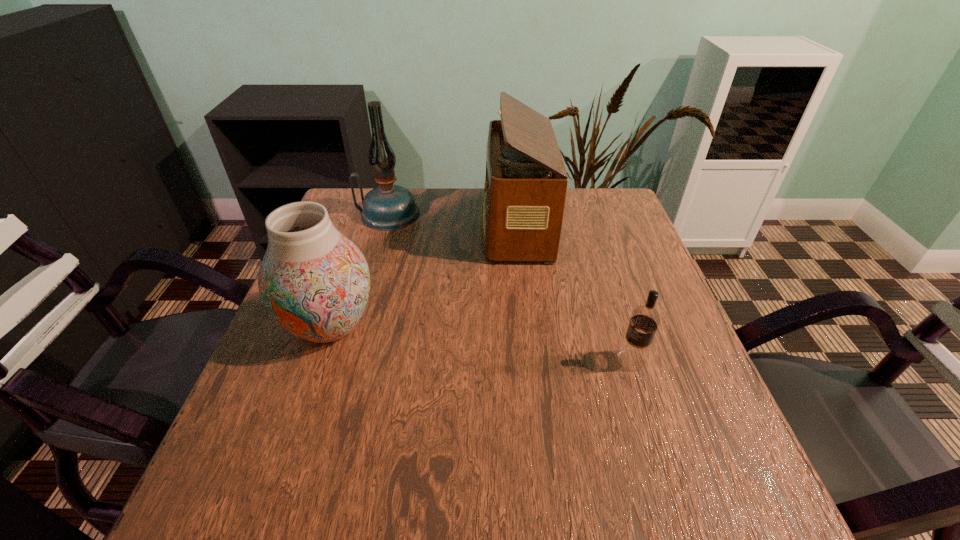
The image size is (960, 540). In order to click on unoccupied position between the oil lamp and the radio receiver in this screenshot , I will do `click(452, 219)`.

I want to click on free space that is in between the vodka and the oil lamp, so click(510, 287).

The width and height of the screenshot is (960, 540). I want to click on free space between the radio receiver and the rightmost object, so click(x=573, y=292).

Point out which object is positioned as the third nearest to the oil lamp. Please provide its 2D coordinates. Your answer should be formatted as a tuple, i.e. [(x, y)], where the tuple contains the x and y coordinates of a point satisfying the conditions above.

[(633, 354)]

Select which object is the second closest to the oil lamp. Please provide its 2D coordinates. Your answer should be formatted as a tuple, i.e. [(x, y)], where the tuple contains the x and y coordinates of a point satisfying the conditions above.

[(314, 281)]

Where is `free location that satisfies the following two spatial constraints: 1. on the back side of the oil lamp; 2. on the left side of the vase`? The width and height of the screenshot is (960, 540). free location that satisfies the following two spatial constraints: 1. on the back side of the oil lamp; 2. on the left side of the vase is located at coordinates (369, 214).